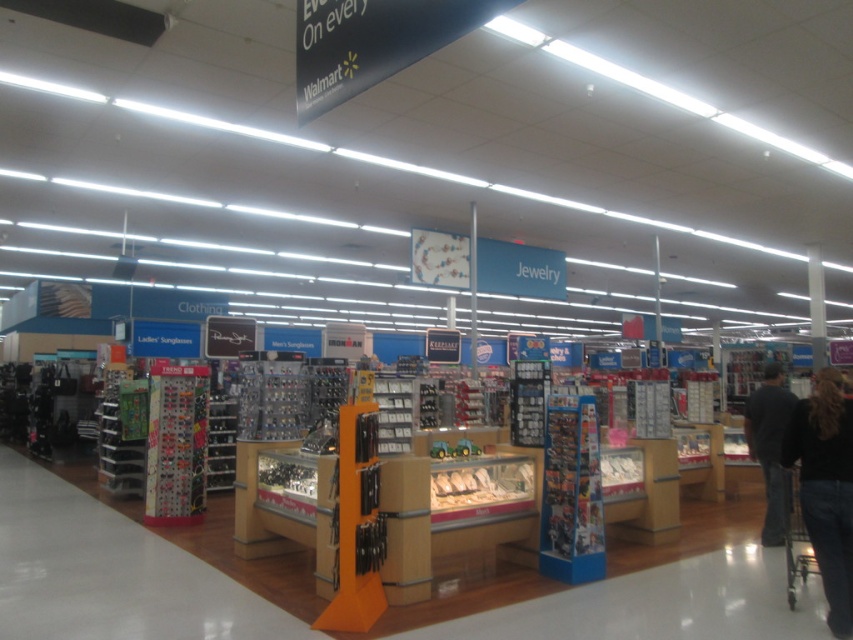
Is black denim jeans at lower right above black fabric pants at lower right?

Yes.

Between black denim jeans at lower right and black fabric pants at lower right, which one appears on the left side from the viewer's perspective?

black denim jeans at lower right

Between point (799, 490) and point (758, 440), which one is positioned in front?

Point (799, 490)

I want to click on black denim jeans at lower right, so click(x=827, y=486).

Is black fabric pants at lower right smaller than metallic silver shopping cart at lower right?

Correct, black fabric pants at lower right occupies less space than metallic silver shopping cart at lower right.

Who is positioned more to the right, black fabric pants at lower right or metallic silver shopping cart at lower right?

From the viewer's perspective, black fabric pants at lower right appears more on the right side.

Who is more forward, [766,481] or [795,508]?

Point [795,508] is in front.

Locate an element on the screen. This screenshot has height=640, width=853. black fabric pants at lower right is located at coordinates (769, 445).

Looking at this image, is the position of black denim jeans at lower right more distant than that of metallic silver shopping cart at lower right?

That is False.

Is point (808, 472) positioned behind point (790, 525)?

No, (808, 472) is closer to viewer.

I want to click on black denim jeans at lower right, so click(827, 486).